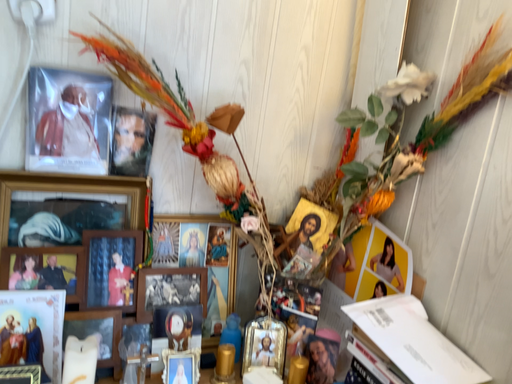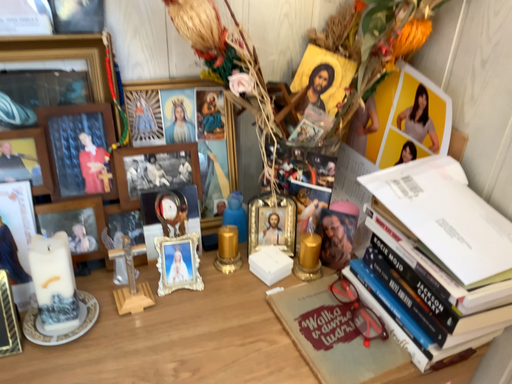
Question: Which way did the camera rotate in the video?

Choices:
 (A) rotated upward
 (B) rotated downward

Answer: (B)